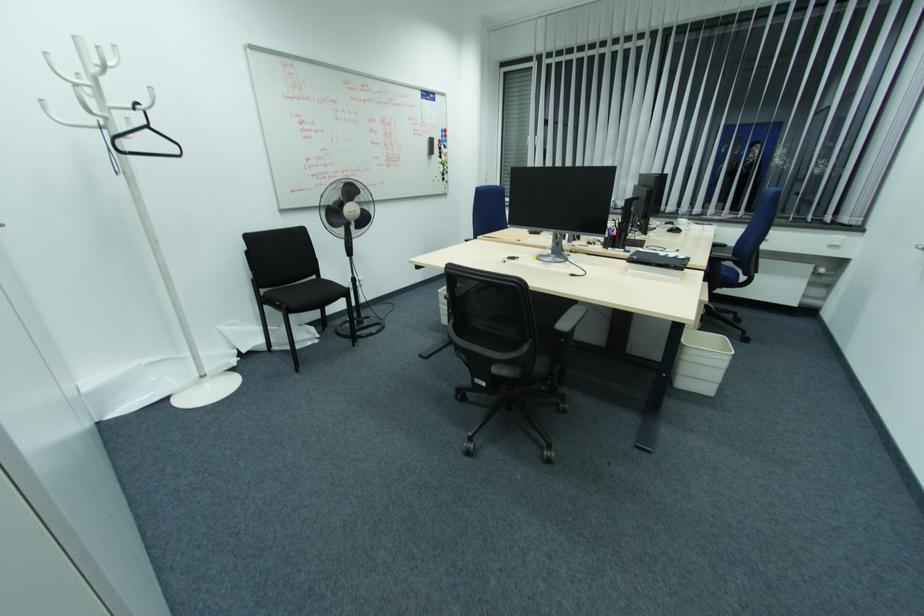
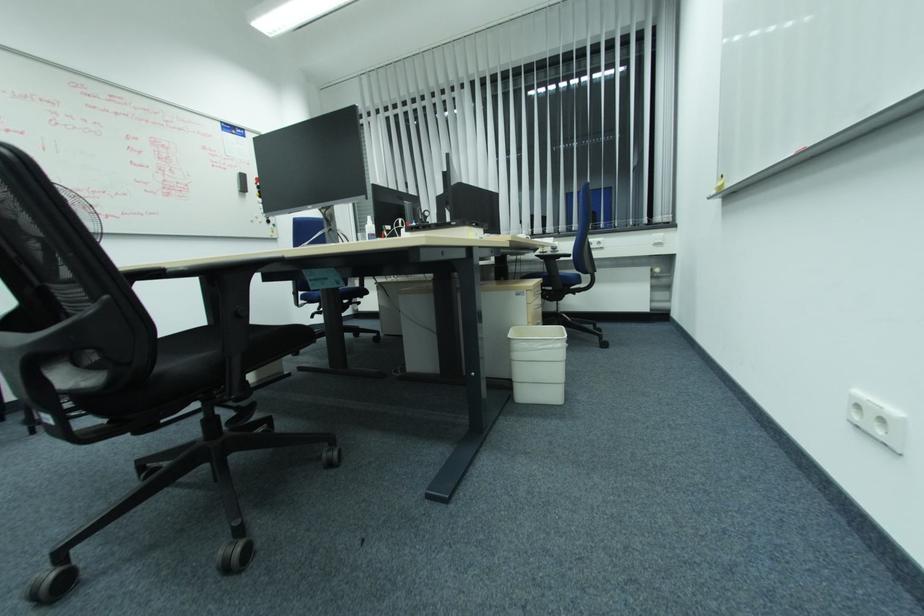
In a continuous first-person perspective shot, in which direction is the camera moving?

The movement direction of the cameraman is right, forward.